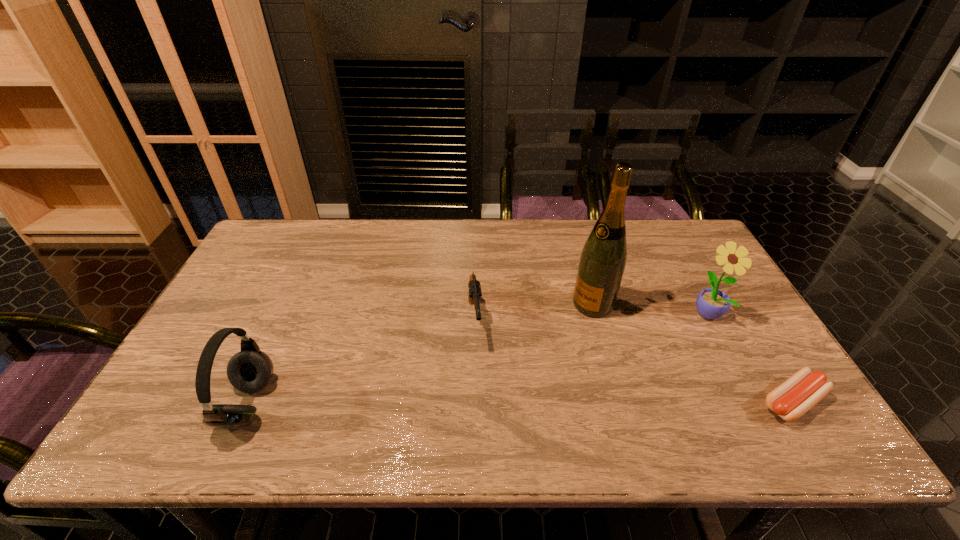
This screenshot has width=960, height=540. What are the coordinates of `free spot on the desktop that is between the headset and the shortest object and is positioned on the front-facing side of the sunflower` in the screenshot? It's located at tap(577, 403).

This screenshot has height=540, width=960. Identify the location of free space on the desktop that is between the third tallest object and the sausage and is positioned on the front-facing side of the wine bottle. (459, 403).

At what (x,y) coordinates should I click in order to perform the action: click on vacant space on the desktop that is between the headset and the shortest object and is positioned along the barrel of the gun. Please return your answer as a coordinate pair (x, y). Looking at the image, I should click on (484, 403).